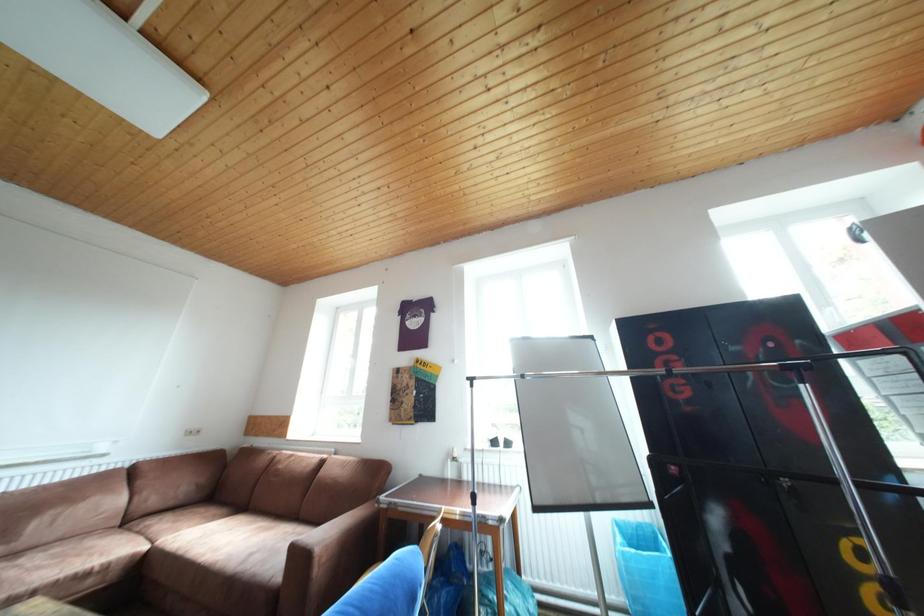
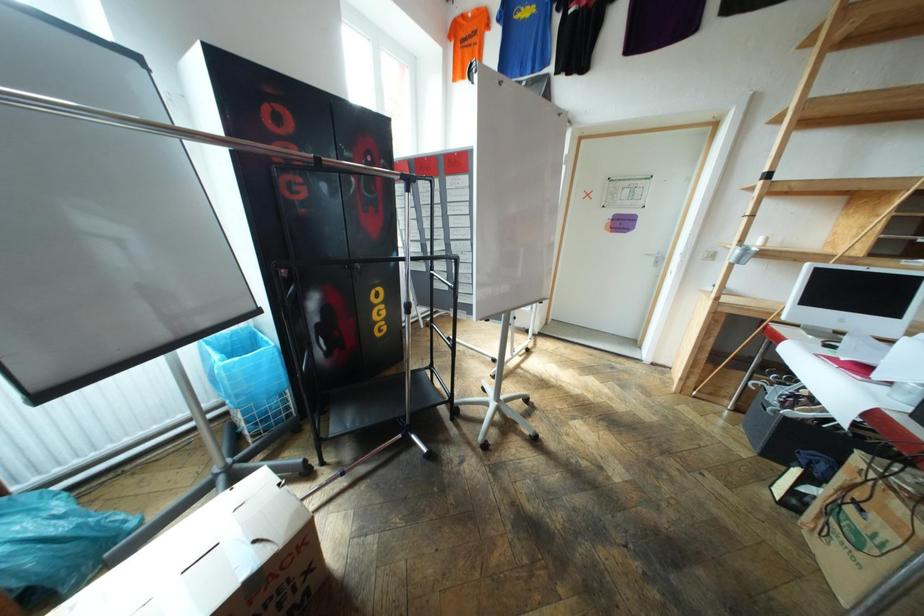
Based on the continuous images, in which direction is the camera rotating?

The camera's rotation is toward right-down.